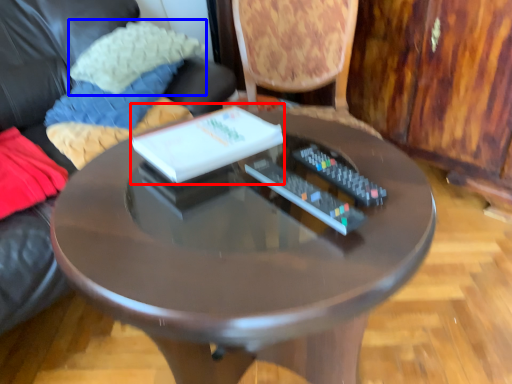
Question: Which object is further to the camera taking this photo, book (highlighted by a red box) or pillow (highlighted by a blue box)?

Choices:
 (A) book
 (B) pillow

Answer: (B)